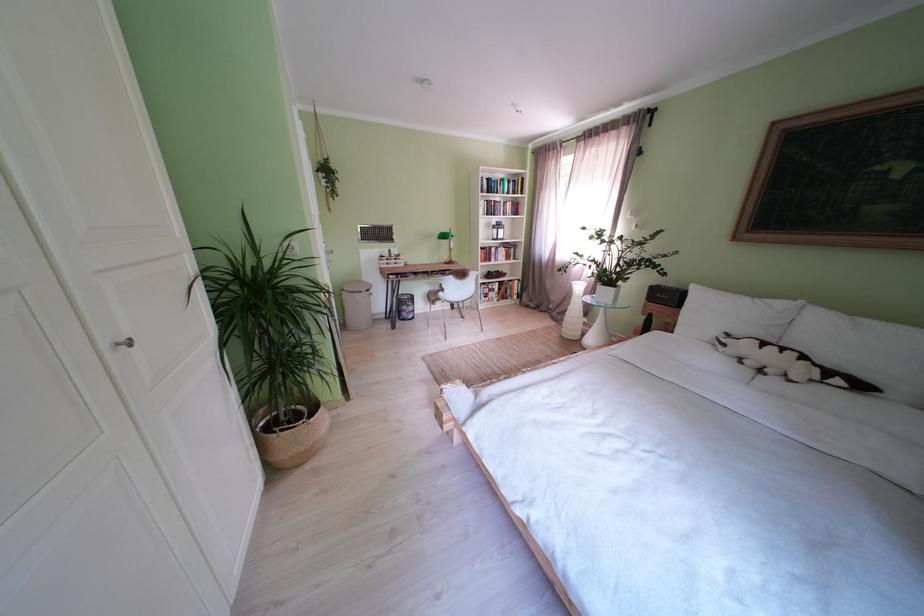
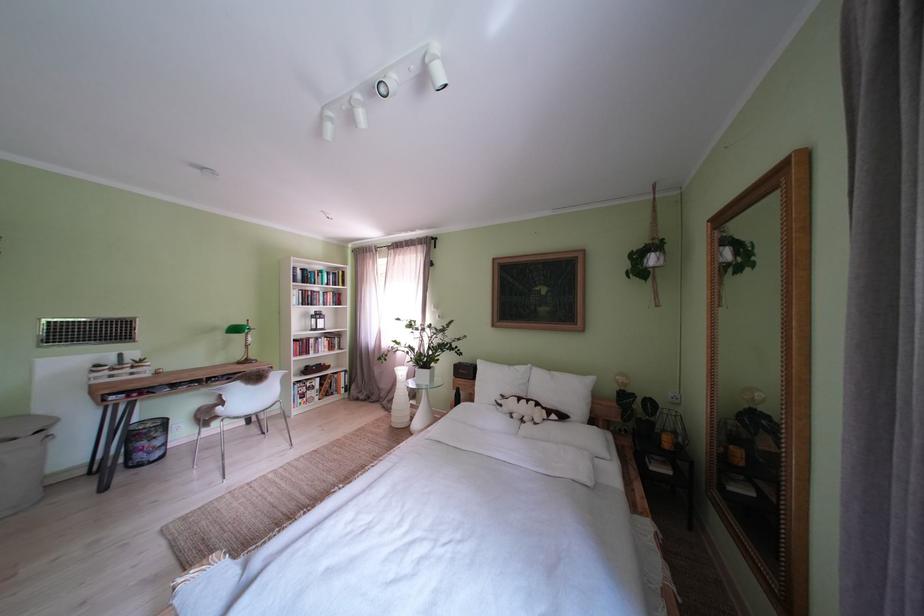
The point at (569, 323) is marked in the first image. Where is the corresponding point in the second image?

(400, 411)